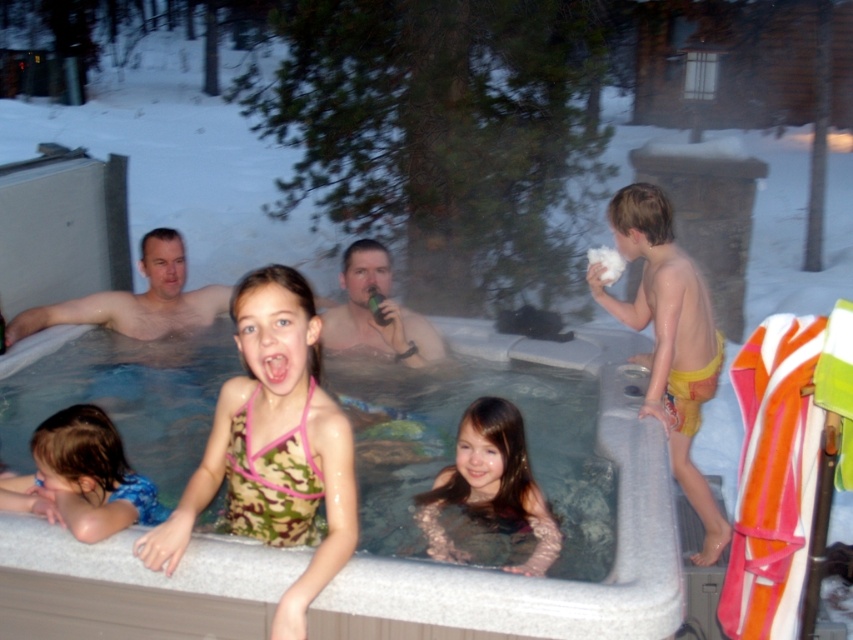
Based on the photo, which is below, blue fabric at lower left or smooth skin man at left?

blue fabric at lower left is lower down.

What do you see at coordinates (82, 477) in the screenshot? The height and width of the screenshot is (640, 853). I see `blue fabric at lower left` at bounding box center [82, 477].

This screenshot has height=640, width=853. Find the location of `blue fabric at lower left`. blue fabric at lower left is located at coordinates (82, 477).

Can you confirm if blue fabric at lower left is thinner than smooth pink swimsuit at center?

In fact, blue fabric at lower left might be wider than smooth pink swimsuit at center.

The image size is (853, 640). Identify the location of blue fabric at lower left. (82, 477).

Which is below, smooth pink swimsuit at center or smooth tan skin at center?

Positioned lower is smooth pink swimsuit at center.

Who is taller, smooth pink swimsuit at center or smooth tan skin at center?

With more height is smooth tan skin at center.

Is point (427, 538) positioned in front of point (337, 323)?

That is True.

The height and width of the screenshot is (640, 853). What are the coordinates of `smooth pink swimsuit at center` in the screenshot? It's located at (490, 484).